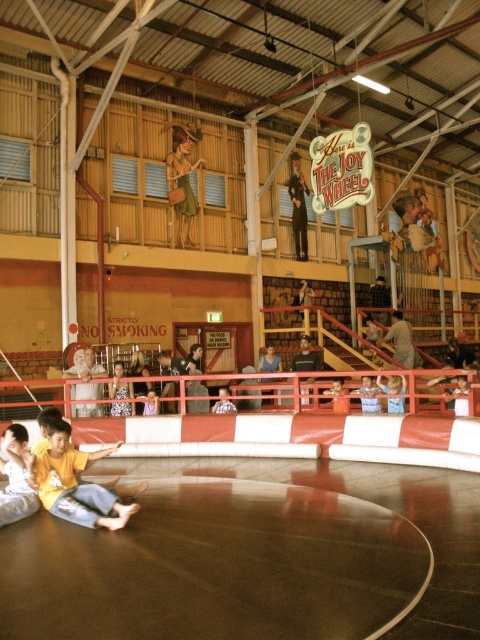
Question: Can you confirm if yellow matte shirt at lower left is positioned above metallic gold statue at upper center?

Choices:
 (A) yes
 (B) no

Answer: (B)

Question: Which object is farther from the camera taking this photo?

Choices:
 (A) matte brown hat at upper center
 (B) metallic gold statue at upper center

Answer: (B)

Question: Does matte brown hat at upper center lie in front of yellow fabric boy at lower left?

Choices:
 (A) no
 (B) yes

Answer: (A)

Question: Among these objects, which one is nearest to the camera?

Choices:
 (A) metallic gold statue at upper center
 (B) yellow fabric shirt at lower left

Answer: (B)

Question: Among these points, which one is farthest from the camera?

Choices:
 (A) (177, 138)
 (B) (63, 508)
 (C) (400, 406)

Answer: (A)

Question: Is the position of yellow fabric boy at lower left more distant than that of yellow fabric shirt at lower left?

Choices:
 (A) no
 (B) yes

Answer: (A)